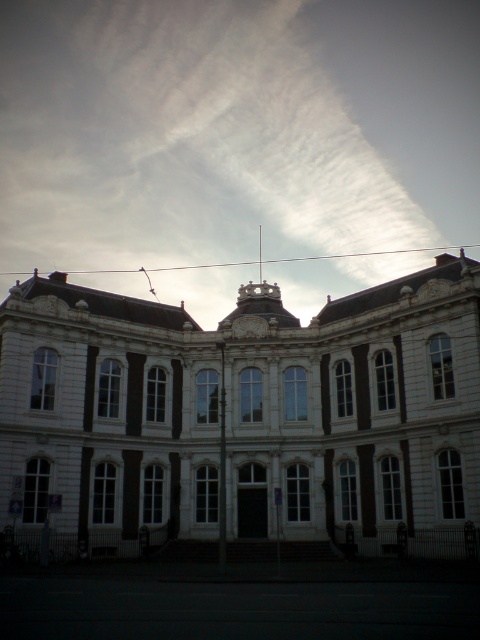
Does white cotton cloud at upper center appear on the left side of matte white clock at center?

Correct, you'll find white cotton cloud at upper center to the left of matte white clock at center.

Does point (64, 205) lie in front of point (257, 333)?

That is False.

Locate an element on the screen. white cotton cloud at upper center is located at coordinates (227, 131).

The width and height of the screenshot is (480, 640). What are the coordinates of `white cotton cloud at upper center` in the screenshot? It's located at (227, 131).

Is point (421, 163) behind point (391, 394)?

Yes, point (421, 163) is farther from viewer.

Image resolution: width=480 pixels, height=640 pixels. What do you see at coordinates (227, 131) in the screenshot?
I see `white cotton cloud at upper center` at bounding box center [227, 131].

The width and height of the screenshot is (480, 640). Find the location of `white cotton cloud at upper center`. white cotton cloud at upper center is located at coordinates (227, 131).

Is white stone building at center thinner than matte white clock at center?

In fact, white stone building at center might be wider than matte white clock at center.

Is white stone building at center positioned behind matte white clock at center?

No, it is not.

This screenshot has height=640, width=480. What are the coordinates of `white stone building at center` in the screenshot? It's located at (243, 419).